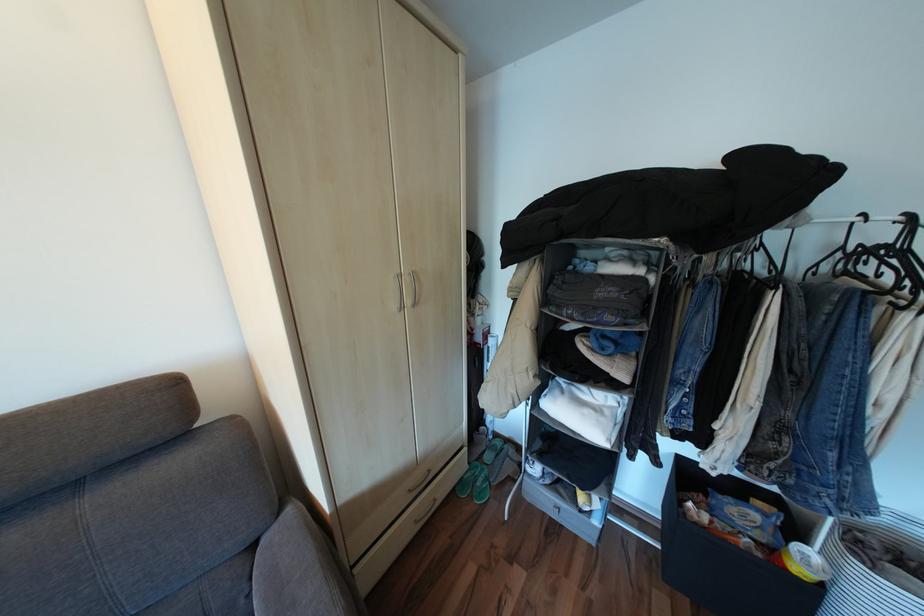
The location [864,206] corresponds to which object?

This point indicates the black clothes hanger.